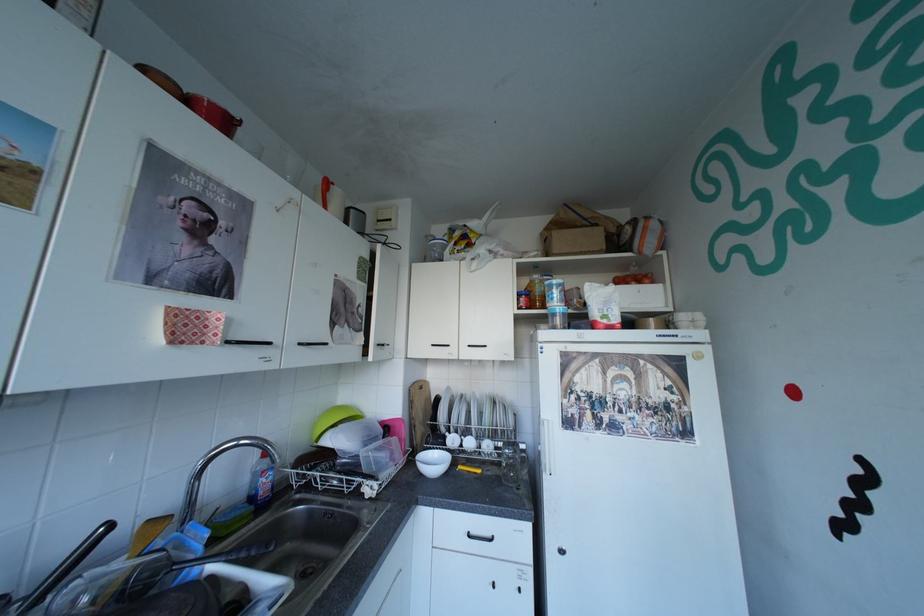
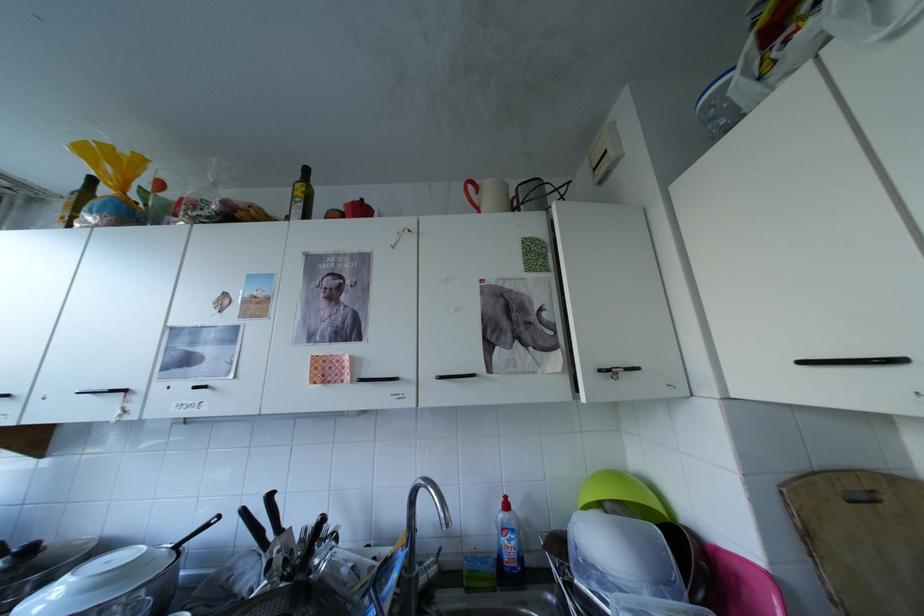
Question: Based on the continuous images, in which direction is the camera rotating? Reply with the corresponding letter.

Choices:
 (A) Left
 (B) Right
 (C) Up
 (D) Down

Answer: (A)